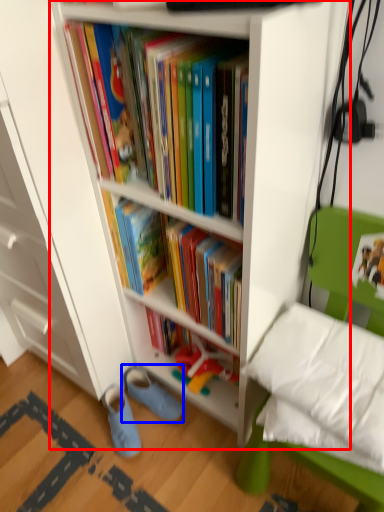
Question: Which of the following is the farthest to the observer, bookcase (highlighted by a red box) or footwear (highlighted by a blue box)?

Choices:
 (A) bookcase
 (B) footwear

Answer: (B)